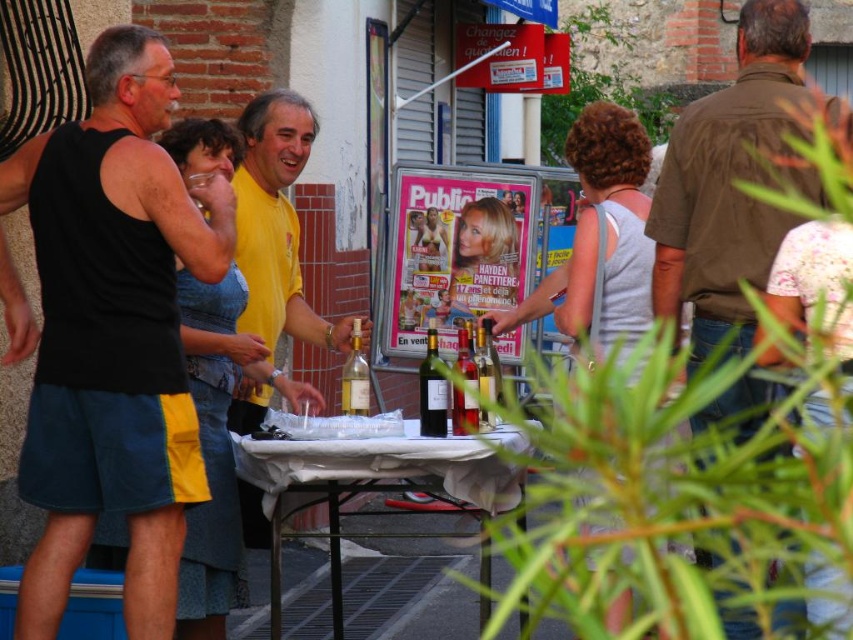
Is black fabric tank top at left positioned at the back of white cloth-covered table at center?

No.

Who is lower down, black fabric tank top at left or white cloth-covered table at center?

Positioned lower is white cloth-covered table at center.

Is point (158, 129) positioned in front of point (515, 474)?

No, it is behind (515, 474).

Identify the location of black fabric tank top at left. The image size is (853, 640). (112, 333).

Between dark green glass bottle at center and translucent glass wine bottle at center, which one appears on the left side from the viewer's perspective?

Positioned to the left is dark green glass bottle at center.

Is dark green glass bottle at center bigger than translucent glass wine bottle at center?

Incorrect, dark green glass bottle at center is not larger than translucent glass wine bottle at center.

Does point (437, 392) come behind point (485, 333)?

No, (437, 392) is closer to viewer.

This screenshot has width=853, height=640. Find the location of `dark green glass bottle at center`. dark green glass bottle at center is located at coordinates (432, 392).

Looking at this image, can you confirm if denim skirt at center is smaller than green glass wine bottle at center?

Yes.

Between denim skirt at center and green glass wine bottle at center, which one has less height?

denim skirt at center

Find the location of a particular element. denim skirt at center is located at coordinates (212, 449).